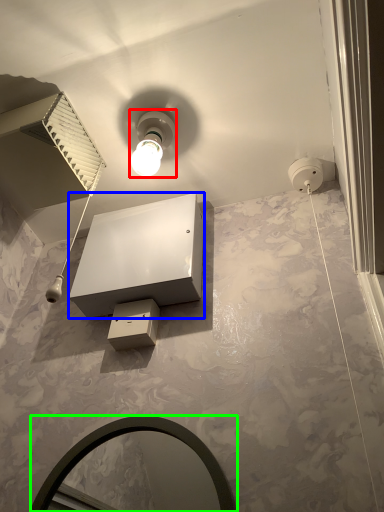
Question: Which is farther away from light fixture (highlighted by a red box)? vanity (highlighted by a blue box) or mirror (highlighted by a green box)?

Choices:
 (A) vanity
 (B) mirror

Answer: (B)